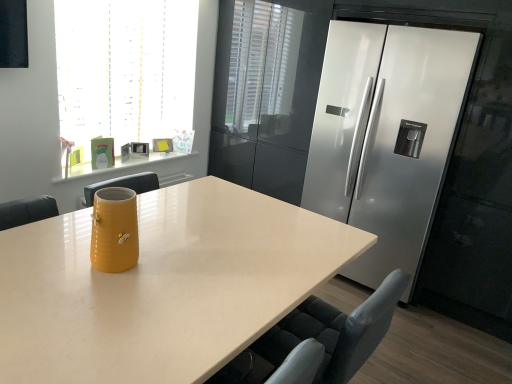
Where is `free space in front of yellow ceramic vase at center`? free space in front of yellow ceramic vase at center is located at coordinates (93, 289).